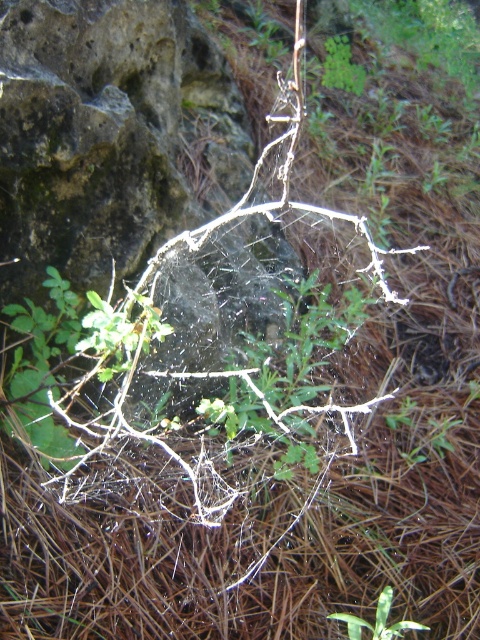
Question: Is the position of green leafy plant at upper center less distant than that of green leafy plant at center?

Choices:
 (A) yes
 (B) no

Answer: (B)

Question: Which of the following is the closest to the observer?

Choices:
 (A) (396, 627)
 (B) (350, 92)

Answer: (A)

Question: Is green leafy plant at upper center positioned in front of green leafy plant at center?

Choices:
 (A) no
 (B) yes

Answer: (A)

Question: Is green leafy plant at upper center positioned behind green leafy plant at center?

Choices:
 (A) no
 (B) yes

Answer: (B)

Question: Which point is farther to the camera?

Choices:
 (A) green leafy plant at upper center
 (B) green leafy plant at center

Answer: (A)